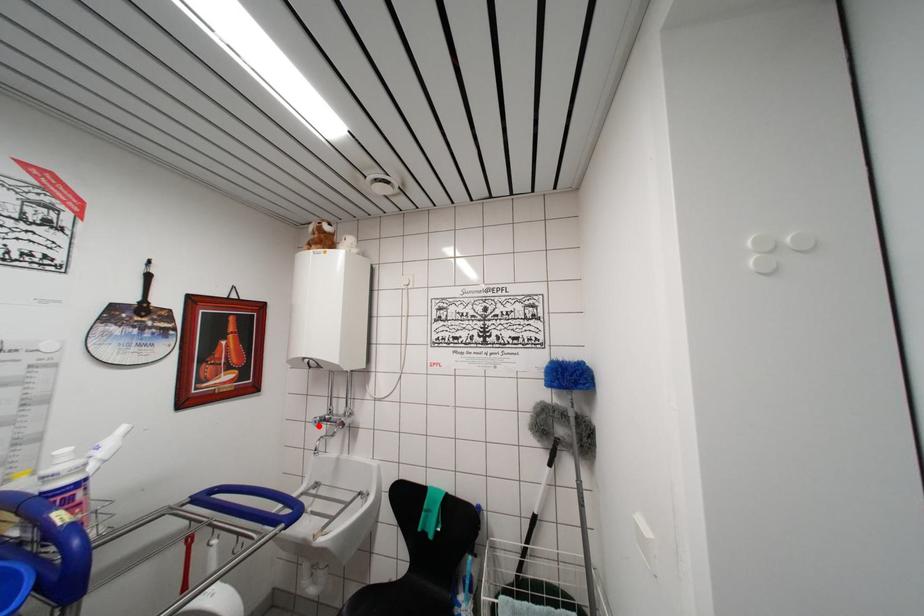
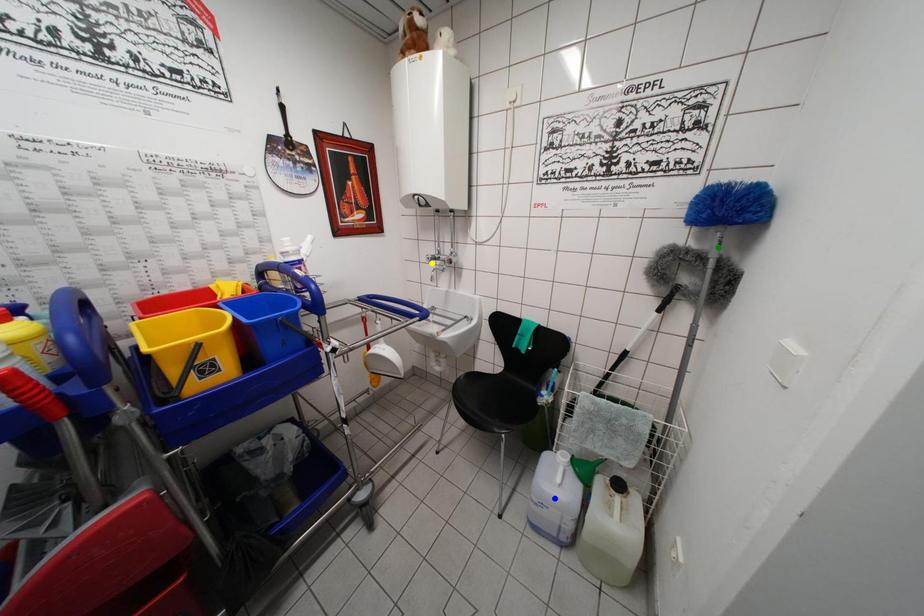
Question: I am providing you with two images of the same scene from different viewpoints. A red point is marked on the first image. You are given multiple points on the second image. Which mark in image 2 goes with the point in image 1?

Choices:
 (A) yellow point
 (B) green point
 (C) blue point

Answer: (A)